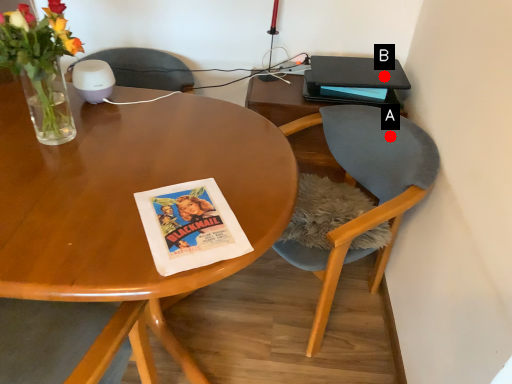
Question: Two points are circled on the image, labeled by A and B beside each circle. Which point is further to the camera?

Choices:
 (A) A is further
 (B) B is further

Answer: (B)